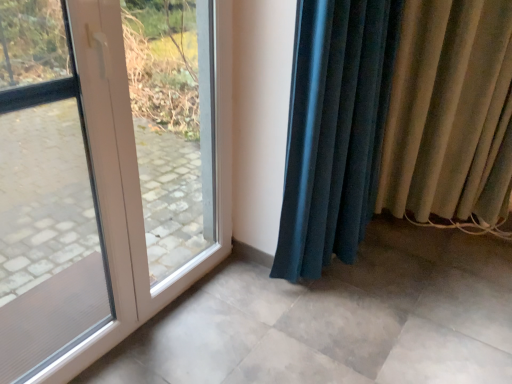
At what (x,y) coordinates should I click in order to perform the action: click on vacant area in front of velvet teal curtain at lower right, acting as the first curtain starting from the left. Please return your answer as a coordinate pair (x, y). Looking at the image, I should click on (333, 337).